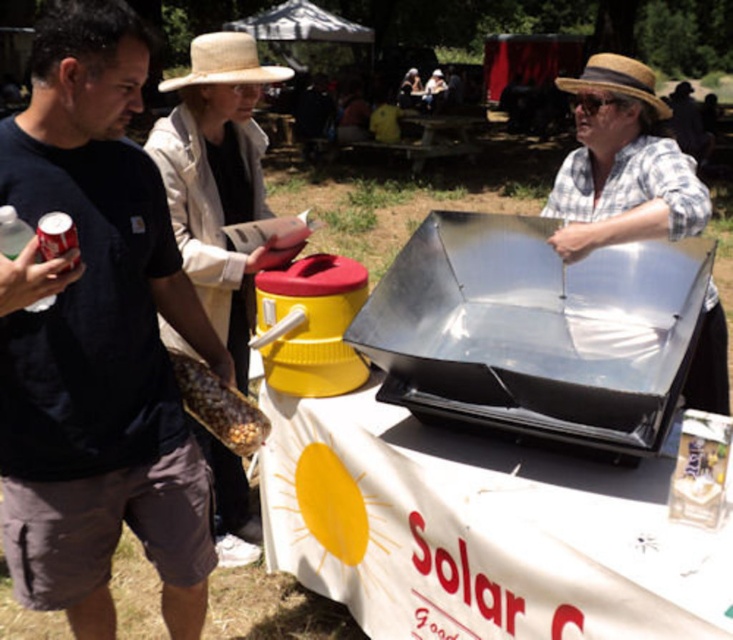
You are a photographer at the solar energy demonstration. You need to take a photo that includes both the straw hat at upper center and the straw hat at center. Which hat will appear larger in the photo?

The straw hat at upper center is further to the viewer than the straw hat at center, so it will appear larger in the photo.